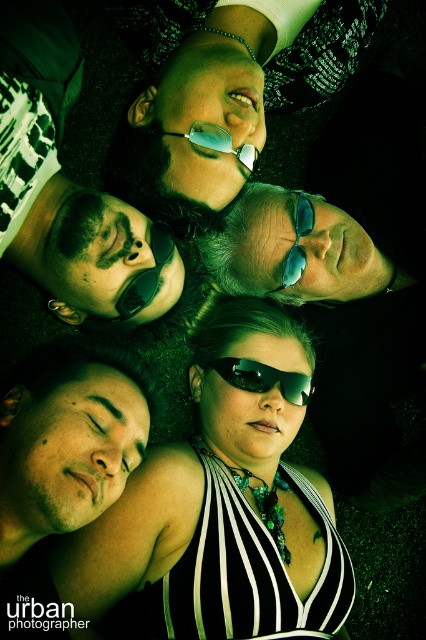
Can you confirm if matte black face at lower left is taller than matte blue goggles at upper center?

Correct, matte black face at lower left is much taller as matte blue goggles at upper center.

Is point (74, 458) farther from viewer compared to point (236, 157)?

That is False.

Where is `matte black face at lower left`? This screenshot has height=640, width=426. matte black face at lower left is located at coordinates (69, 438).

Is black striped tank top at center taller than matte black sunglasses at upper left?

Indeed, black striped tank top at center has a greater height compared to matte black sunglasses at upper left.

Does black striped tank top at center have a lesser width compared to matte black sunglasses at upper left?

No.

You are a GUI agent. You are given a task and a screenshot of the screen. Output one action in this format:
    pyautogui.click(x=<x>, y=<y>)
    Task: Click on the black striped tank top at center
    
    Given the screenshot: What is the action you would take?
    pyautogui.click(x=222, y=502)

Is black plastic sunglasses at center smaller than sunglasses at center?

Yes, black plastic sunglasses at center is smaller than sunglasses at center.

What do you see at coordinates (264, 378) in the screenshot? This screenshot has width=426, height=640. I see `black plastic sunglasses at center` at bounding box center [264, 378].

Is point (261, 365) positioned behind point (299, 257)?

Yes, it is behind point (299, 257).

You are a GUI agent. You are given a task and a screenshot of the screen. Output one action in this format:
    pyautogui.click(x=<x>, y=<y>)
    Task: Click on the black plastic sunglasses at center
    This screenshot has height=640, width=426.
    Given the screenshot: What is the action you would take?
    pyautogui.click(x=264, y=378)